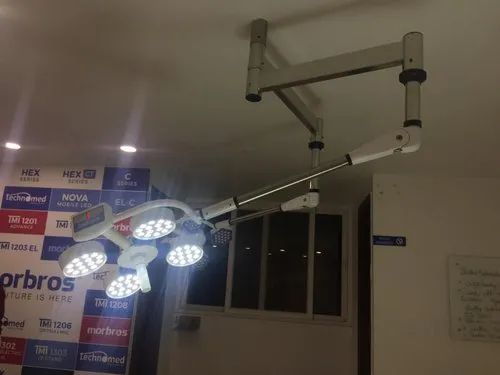
This screenshot has height=375, width=500. What are the coordinates of `window` in the screenshot? It's located at (293, 278).